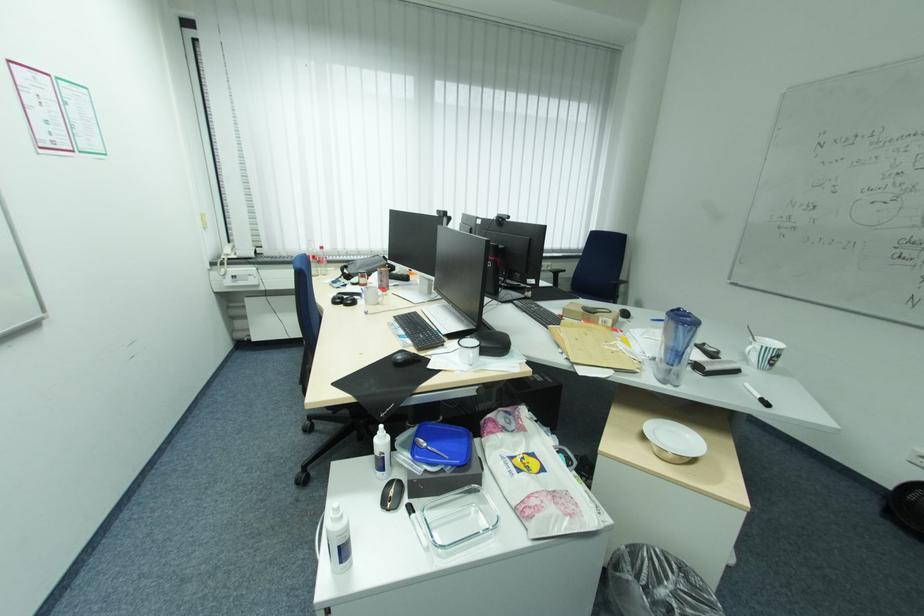
At what (x,y) coordinates should I click in order to perform the action: click on white mug handle. Please return your answer as a coordinate pair (x, y). Looking at the image, I should click on (468, 355).